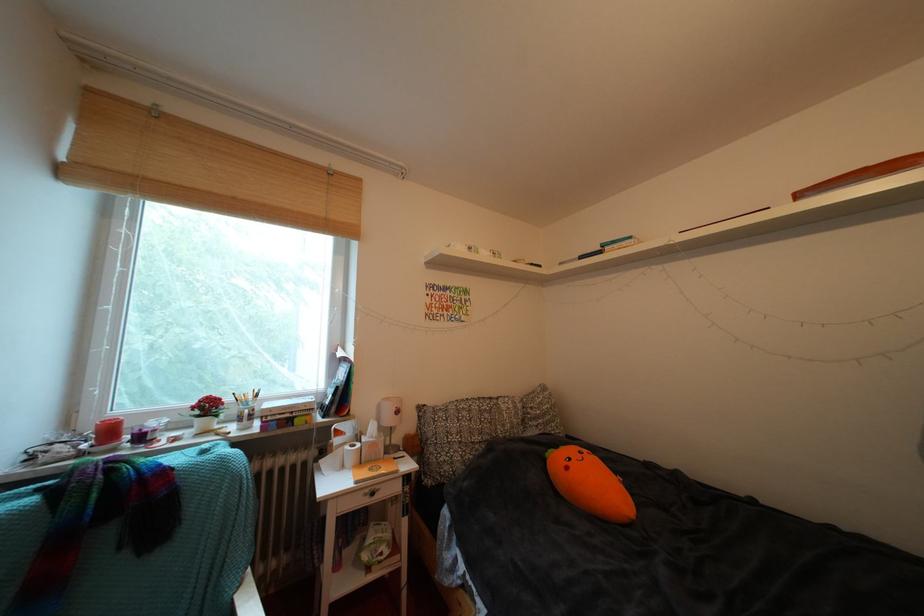
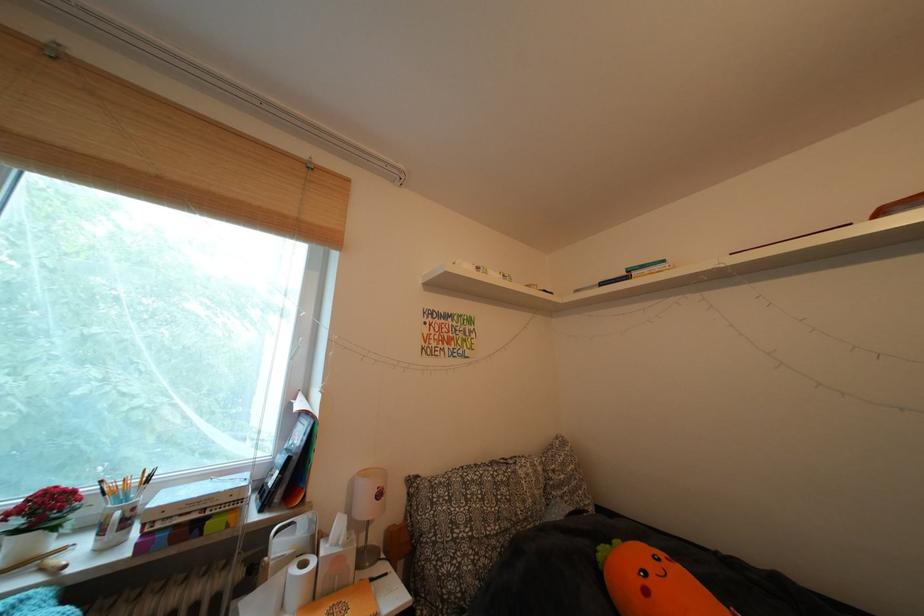
Where in the second image is the point corresponding to [257,408] from the first image?

(137, 500)